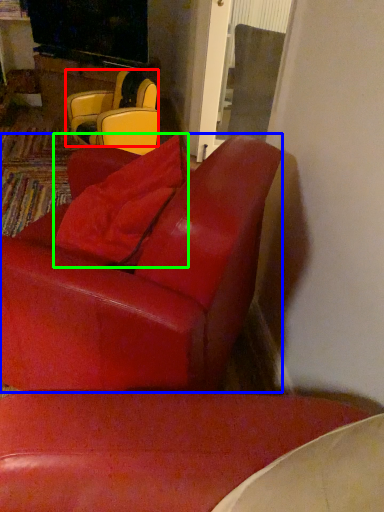
Question: Estimate the real-world distances between objects in this image. Which object is farther from chair (highlighted by a red box), chair (highlighted by a blue box) or pillow (highlighted by a green box)?

Choices:
 (A) chair
 (B) pillow

Answer: (A)